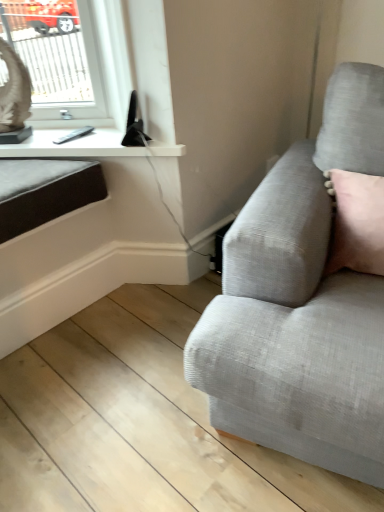
Identify the location of vacant space that is to the left of textured gray couch at right. The height and width of the screenshot is (512, 384). (118, 381).